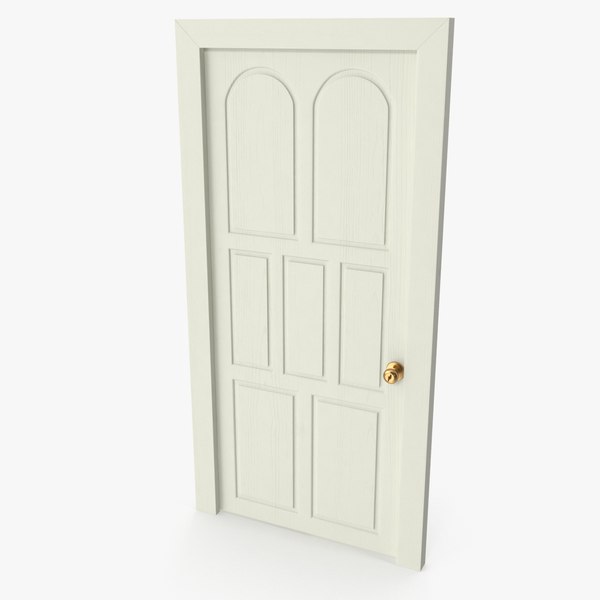
This screenshot has height=600, width=600. I want to click on keyhole, so click(390, 377).